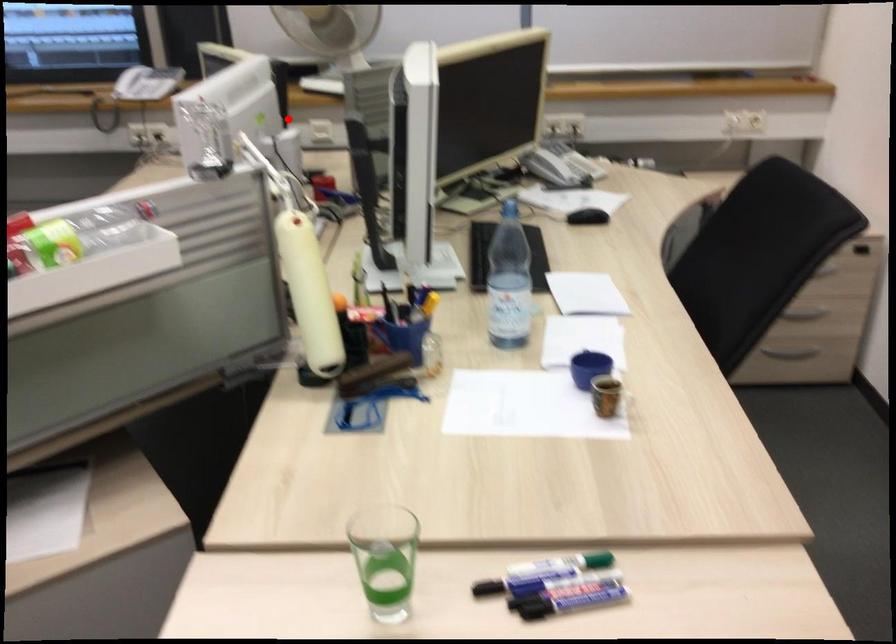
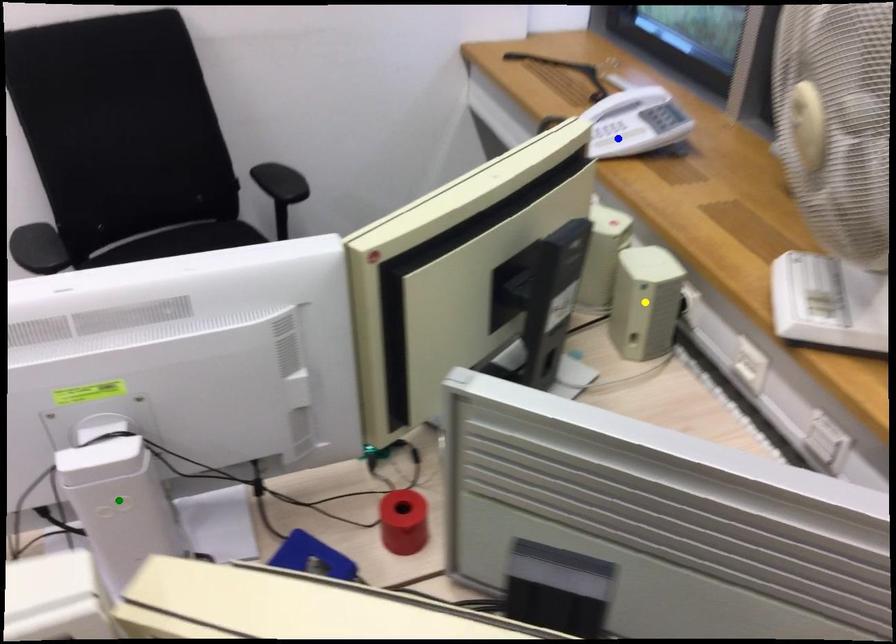
Question: I am providing you with two images of the same scene from different viewpoints. A red point is marked on the first image. You are given multiple points on the second image. Which mark in image 2 goes with the point in image 1?

Choices:
 (A) yellow point
 (B) green point
 (C) blue point

Answer: (A)